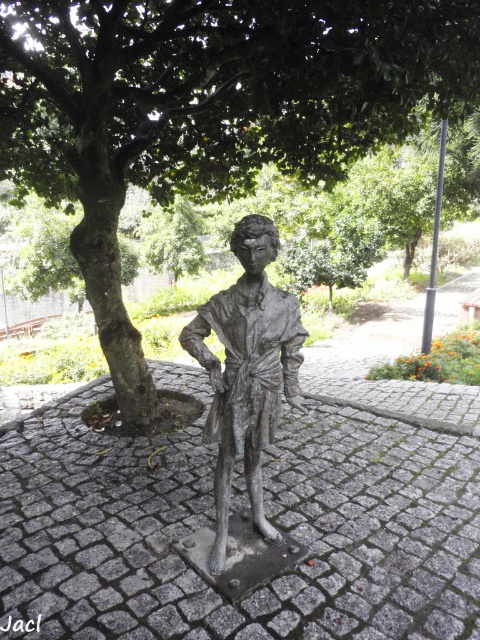
Can you confirm if green leafy tree at center is positioned below bronze statue at center?

Incorrect, green leafy tree at center is not positioned below bronze statue at center.

Which is more to the left, green leafy tree at center or bronze statue at center?

Positioned to the left is green leafy tree at center.

Based on the photo, who is more forward, [153,28] or [285,339]?

Positioned in front is point [285,339].

In order to click on green leafy tree at center in this screenshot , I will do `click(207, 108)`.